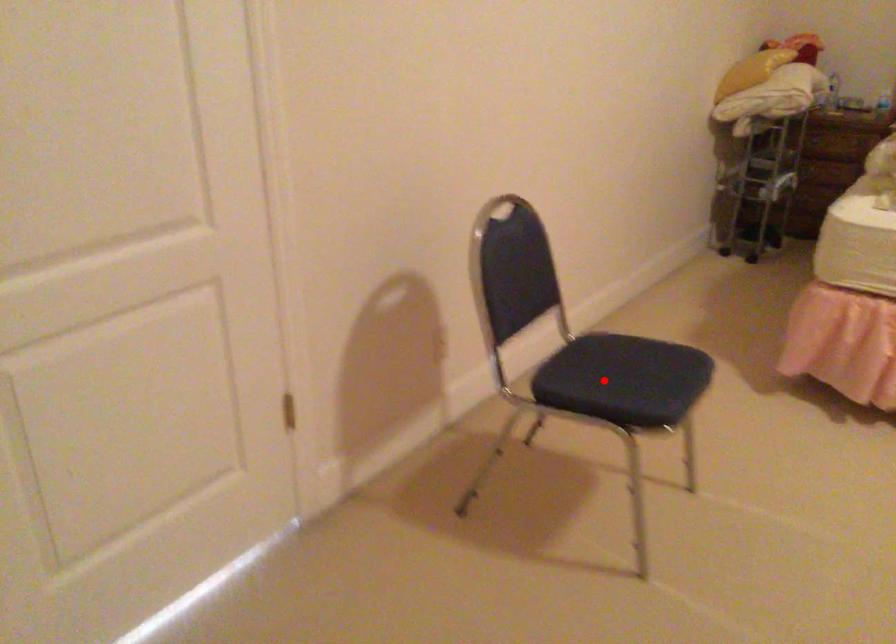
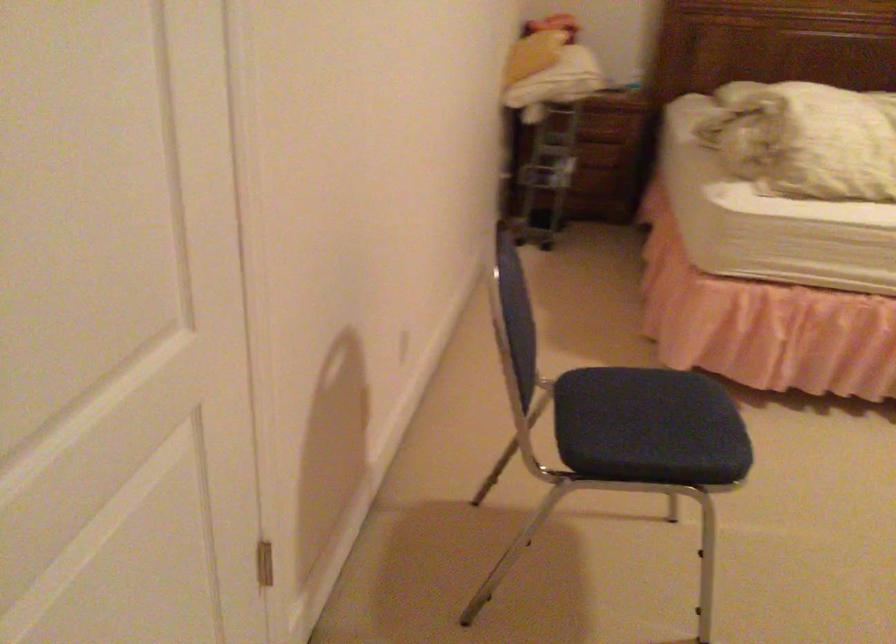
Find the pixel in the second image that matches the highlighted location in the first image.

(650, 433)